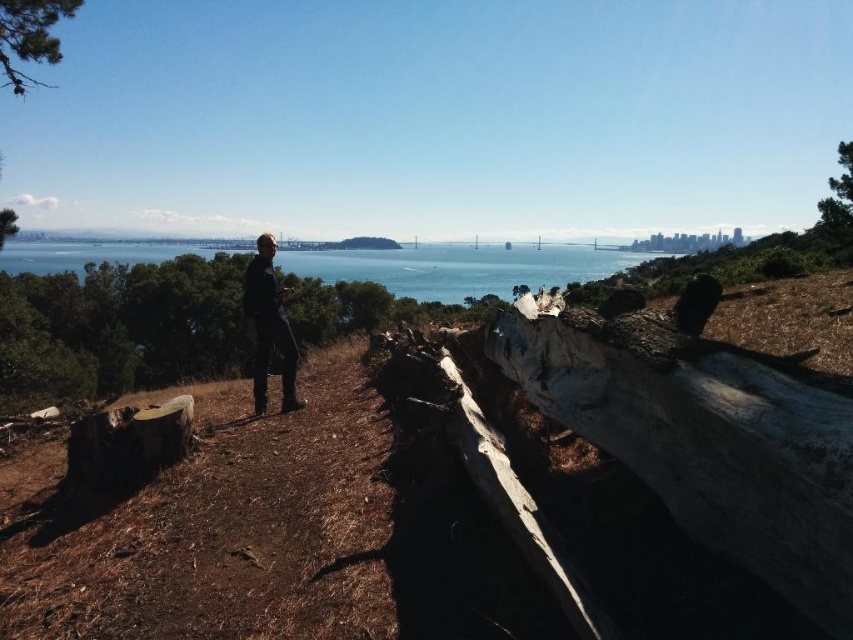
Question: Which object is closer to the camera taking this photo?

Choices:
 (A) blue water at center
 (B) green rough bark tree at upper left
 (C) green rough bark tree at upper right

Answer: (B)

Question: Where is dark blue jeans at center located in relation to green rough bark tree at upper right in the image?

Choices:
 (A) above
 (B) below

Answer: (B)

Question: Which point is farther to the camera?

Choices:
 (A) (73, 12)
 (B) (848, 212)
 (C) (294, 368)

Answer: (B)

Question: Does green rough bark tree at upper left have a lesser width compared to green rough bark tree at upper right?

Choices:
 (A) no
 (B) yes

Answer: (B)

Question: Can you confirm if blue water at center is positioned above green rough bark tree at upper left?

Choices:
 (A) yes
 (B) no

Answer: (B)

Question: Which object appears farthest from the camera in this image?

Choices:
 (A) green rough bark tree at upper left
 (B) blue water at center

Answer: (B)